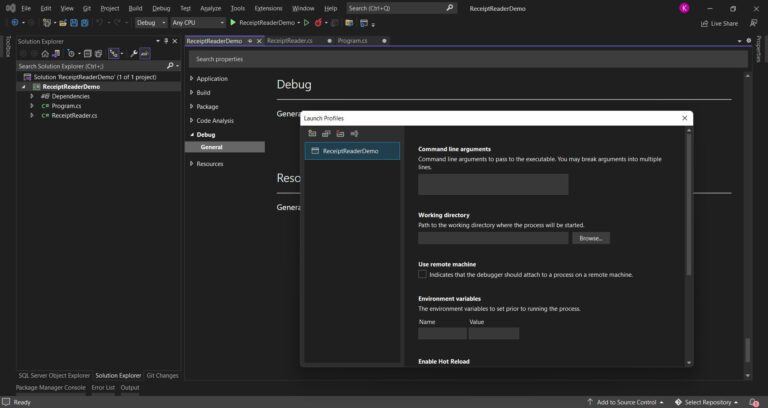
The height and width of the screenshot is (408, 768). I want to click on exit icon, so click(x=757, y=6), click(x=682, y=120), click(x=257, y=39), click(x=326, y=39), click(x=382, y=42).